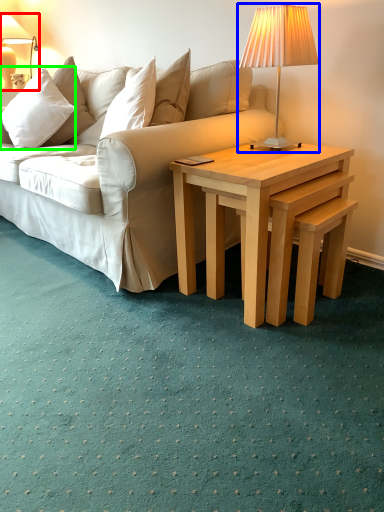
Question: Based on their relative distances, which object is nearer to lamp (highlighted by a red box)? Choose from lamp (highlighted by a blue box) and pillow (highlighted by a green box).

Choices:
 (A) lamp
 (B) pillow

Answer: (B)